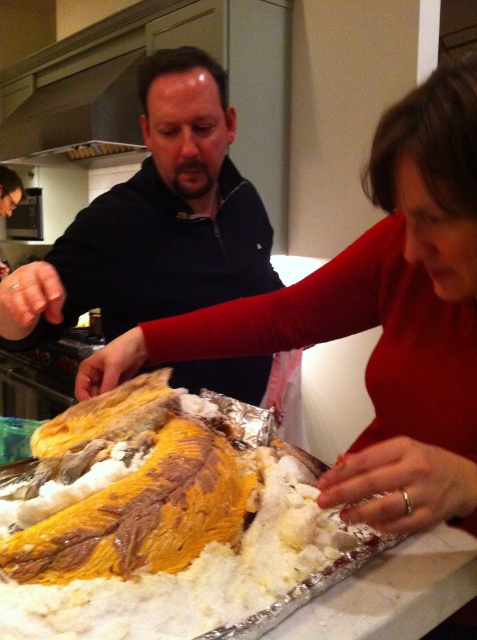
Is golden-brown crispy fish at center taller than dark blue sweater at center?

No.

Is golden-brown crispy fish at center closer to the viewer compared to dark blue sweater at center?

Yes, it is in front of dark blue sweater at center.

You are a GUI agent. You are given a task and a screenshot of the screen. Output one action in this format:
    pyautogui.click(x=<x>, y=<y>)
    Task: Click on the golden-brown crispy fish at center
    The height and width of the screenshot is (640, 477).
    Given the screenshot: What is the action you would take?
    pyautogui.click(x=155, y=518)

This screenshot has height=640, width=477. Identify the location of golden-brown crispy fish at center. (155, 518).